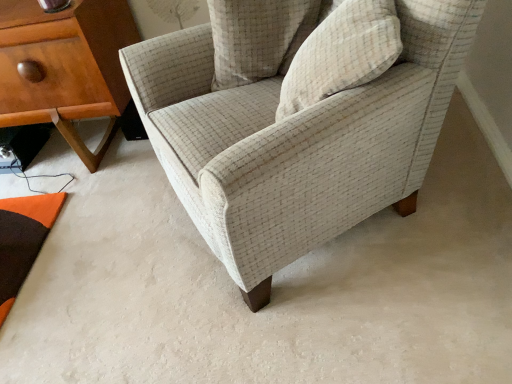
Describe the element at coordinates (341, 54) in the screenshot. I see `beige textured pillow at upper center, marked as the first pillow in a front-to-back arrangement` at that location.

Locate an element on the screen. Image resolution: width=512 pixels, height=384 pixels. beige textured pillow at upper center, marked as the first pillow in a front-to-back arrangement is located at coordinates (341, 54).

The image size is (512, 384). I want to click on textured beige armchair at center, so click(x=298, y=121).

Find the location of a particular element. This screenshot has width=512, height=384. beige textured pillow at upper center, placed as the second pillow when sorted from front to back is located at coordinates (257, 38).

Considering the positions of objects beige textured pillow at upper center, which is the 1th pillow in back-to-front order, and textured beige armchair at center in the image provided, who is more to the left, beige textured pillow at upper center, which is the 1th pillow in back-to-front order, or textured beige armchair at center?

beige textured pillow at upper center, which is the 1th pillow in back-to-front order, is more to the left.

How distant is beige textured pillow at upper center, which is the 1th pillow in back-to-front order, from textured beige armchair at center?

beige textured pillow at upper center, which is the 1th pillow in back-to-front order, and textured beige armchair at center are 10.02 inches apart from each other.

From the image's perspective, count 2nd pillows upward from the textured beige armchair at center and point to it. Please provide its 2D coordinates.

[(257, 38)]

Does beige textured pillow at upper center, placed as the second pillow when sorted from front to back, come behind textured beige armchair at center?

Yes, beige textured pillow at upper center, placed as the second pillow when sorted from front to back, is further from the camera.

How many degrees apart are the facing directions of beige textured pillow at upper center, acting as the 2th pillow starting from the back, and wooden nightstand at left?

The facing directions of beige textured pillow at upper center, acting as the 2th pillow starting from the back, and wooden nightstand at left are 97.2 degrees apart.

Which object is wider, beige textured pillow at upper center, acting as the 2th pillow starting from the back, or wooden nightstand at left?

Wider between the two is wooden nightstand at left.

Can you confirm if beige textured pillow at upper center, marked as the first pillow in a front-to-back arrangement, is bigger than wooden nightstand at left?

Actually, beige textured pillow at upper center, marked as the first pillow in a front-to-back arrangement, might be smaller than wooden nightstand at left.

The image size is (512, 384). In order to click on pillow that is below the wooden nightstand at left (from the image's perspective) in this screenshot , I will do `click(341, 54)`.

Is beige textured pillow at upper center, acting as the 2th pillow starting from the back, not inside textured beige armchair at center?

No.

From the image's perspective, which object appears higher, beige textured pillow at upper center, acting as the 2th pillow starting from the back, or textured beige armchair at center?

beige textured pillow at upper center, acting as the 2th pillow starting from the back, from the image's perspective.

Can you see beige textured pillow at upper center, acting as the 2th pillow starting from the back, touching textured beige armchair at center?

No, beige textured pillow at upper center, acting as the 2th pillow starting from the back, is not beside textured beige armchair at center.

The width and height of the screenshot is (512, 384). In the image, there is a beige textured pillow at upper center, marked as the first pillow in a front-to-back arrangement. Find the location of `pillow below it (from a real-world perspective)`. pillow below it (from a real-world perspective) is located at coordinates (257, 38).

From the image's perspective, is beige textured pillow at upper center, acting as the 2th pillow starting from the back, positioned above or below beige textured pillow at upper center, which is the 1th pillow in back-to-front order?

From the image's perspective, beige textured pillow at upper center, acting as the 2th pillow starting from the back, appears below beige textured pillow at upper center, which is the 1th pillow in back-to-front order.

How much distance is there between beige textured pillow at upper center, acting as the 2th pillow starting from the back, and beige textured pillow at upper center, placed as the second pillow when sorted from front to back?

beige textured pillow at upper center, acting as the 2th pillow starting from the back, is 10.57 inches from beige textured pillow at upper center, placed as the second pillow when sorted from front to back.

Is beige textured pillow at upper center, acting as the 2th pillow starting from the back, positioned far away from beige textured pillow at upper center, which is the 1th pillow in back-to-front order?

That's not correct — beige textured pillow at upper center, acting as the 2th pillow starting from the back, is a little close to beige textured pillow at upper center, which is the 1th pillow in back-to-front order.

From the image's perspective, would you say textured beige armchair at center is positioned over wooden nightstand at left?

No, from the image's perspective, textured beige armchair at center is not over wooden nightstand at left.

Where is `nightstand located behind the textured beige armchair at center`? The image size is (512, 384). nightstand located behind the textured beige armchair at center is located at coordinates (65, 67).

Can you confirm if textured beige armchair at center is bigger than wooden nightstand at left?

Indeed, textured beige armchair at center has a larger size compared to wooden nightstand at left.

At what (x,y) coordinates should I click in order to perform the action: click on chair in front of the wooden nightstand at left. Please return your answer as a coordinate pair (x, y). The height and width of the screenshot is (384, 512). Looking at the image, I should click on (298, 121).

From the picture: Is wooden nightstand at left oriented towards textured beige armchair at center?

No, wooden nightstand at left is not aimed at textured beige armchair at center.

From a real-world perspective, is wooden nightstand at left below textured beige armchair at center?

Indeed, from a real-world perspective, wooden nightstand at left is positioned beneath textured beige armchair at center.

Considering the relative sizes of wooden nightstand at left and beige textured pillow at upper center, which is the 1th pillow in back-to-front order, in the image provided, is wooden nightstand at left taller than beige textured pillow at upper center, which is the 1th pillow in back-to-front order,?

Yes.

Does point (23, 52) appear closer or farther from the camera than point (230, 77)?

Point (23, 52) is farther from the camera than point (230, 77).

In order to click on pillow that is the 1st one above the wooden nightstand at left (from a real-world perspective) in this screenshot , I will do `click(257, 38)`.

Starting from the textured beige armchair at center, which pillow is the 2nd one behind? Please provide its 2D coordinates.

[(257, 38)]

From a real-world perspective, which pillow is the 2nd one above the wooden nightstand at left? Please provide its 2D coordinates.

[(341, 54)]

When comparing their distances from beige textured pillow at upper center, marked as the first pillow in a front-to-back arrangement, does beige textured pillow at upper center, which is the 1th pillow in back-to-front order, or wooden nightstand at left seem closer?

beige textured pillow at upper center, which is the 1th pillow in back-to-front order, is positioned closer to the anchor beige textured pillow at upper center, marked as the first pillow in a front-to-back arrangement.

When comparing their distances from wooden nightstand at left, does beige textured pillow at upper center, placed as the second pillow when sorted from front to back, or textured beige armchair at center seem closer?

Based on the image, beige textured pillow at upper center, placed as the second pillow when sorted from front to back, appears to be nearer to wooden nightstand at left.

Which object lies further to the anchor point beige textured pillow at upper center, acting as the 2th pillow starting from the back, textured beige armchair at center or wooden nightstand at left?

wooden nightstand at left is positioned further to the anchor beige textured pillow at upper center, acting as the 2th pillow starting from the back.

Consider the image. When comparing their distances from wooden nightstand at left, does beige textured pillow at upper center, placed as the second pillow when sorted from front to back, or beige textured pillow at upper center, acting as the 2th pillow starting from the back, seem further?

beige textured pillow at upper center, acting as the 2th pillow starting from the back, is further to wooden nightstand at left.

When comparing their distances from beige textured pillow at upper center, marked as the first pillow in a front-to-back arrangement, does beige textured pillow at upper center, which is the 1th pillow in back-to-front order, or textured beige armchair at center seem further?

beige textured pillow at upper center, which is the 1th pillow in back-to-front order, is positioned further to the anchor beige textured pillow at upper center, marked as the first pillow in a front-to-back arrangement.

Looking at the image, which one is located closer to beige textured pillow at upper center, placed as the second pillow when sorted from front to back, beige textured pillow at upper center, acting as the 2th pillow starting from the back, or wooden nightstand at left?

beige textured pillow at upper center, acting as the 2th pillow starting from the back, is closer to beige textured pillow at upper center, placed as the second pillow when sorted from front to back.

Looking at this image, estimate the real-world distances between objects in this image. Which object is closer to wooden nightstand at left, textured beige armchair at center or beige textured pillow at upper center, placed as the second pillow when sorted from front to back?

Among the two, beige textured pillow at upper center, placed as the second pillow when sorted from front to back, is located nearer to wooden nightstand at left.

Considering their positions, is wooden nightstand at left positioned closer to textured beige armchair at center than beige textured pillow at upper center, placed as the second pillow when sorted from front to back?

beige textured pillow at upper center, placed as the second pillow when sorted from front to back.

Locate an element on the screen. This screenshot has height=384, width=512. pillow between wooden nightstand at left and textured beige armchair at center is located at coordinates (257, 38).

Locate an element on the screen. chair between wooden nightstand at left and beige textured pillow at upper center, marked as the first pillow in a front-to-back arrangement is located at coordinates (298, 121).

Where is `pillow between wooden nightstand at left and beige textured pillow at upper center, acting as the 2th pillow starting from the back, in the horizontal direction`? This screenshot has width=512, height=384. pillow between wooden nightstand at left and beige textured pillow at upper center, acting as the 2th pillow starting from the back, in the horizontal direction is located at coordinates (257, 38).

This screenshot has height=384, width=512. I want to click on pillow between textured beige armchair at center and beige textured pillow at upper center, placed as the second pillow when sorted from front to back, in the front-back direction, so click(x=341, y=54).